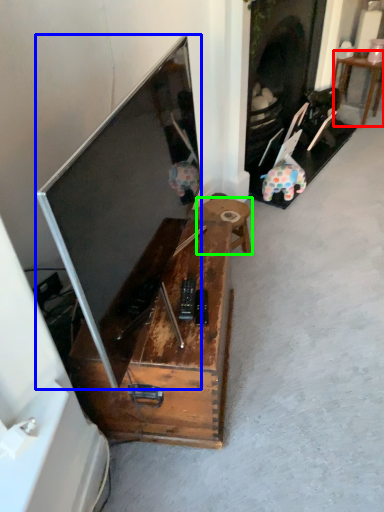
Question: Which object is the closest to the table (highlighted by a red box)? Choose among these: television (highlighted by a blue box) or table (highlighted by a green box).

Choices:
 (A) television
 (B) table

Answer: (B)